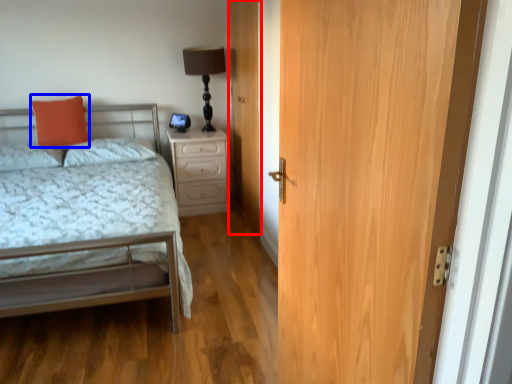
Question: Which object is further to the camera taking this photo, door (highlighted by a red box) or pillow (highlighted by a blue box)?

Choices:
 (A) door
 (B) pillow

Answer: (B)